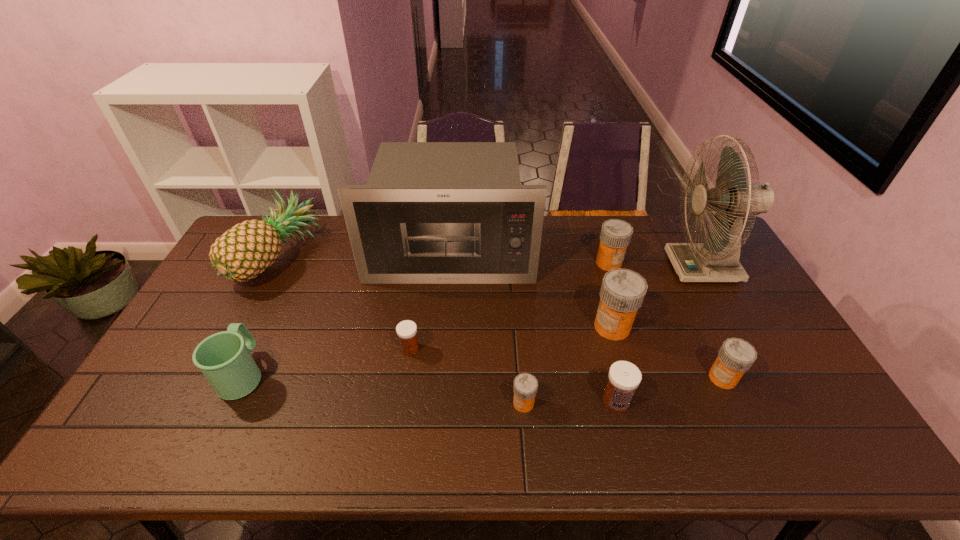
This screenshot has height=540, width=960. I want to click on pineapple that is at the far edge, so click(x=247, y=249).

The width and height of the screenshot is (960, 540). Identify the location of medicine that is positioned at the far edge. (615, 236).

Where is `object at the left edge`? This screenshot has height=540, width=960. object at the left edge is located at coordinates (247, 249).

Find the location of a particular element. The image size is (960, 540). object present at the right edge is located at coordinates (717, 259).

Where is `object located at the far left corner`? object located at the far left corner is located at coordinates (247, 249).

The height and width of the screenshot is (540, 960). I want to click on object present at the far right corner, so click(717, 259).

I want to click on blank space at the far edge of the desktop, so click(x=328, y=242).

The image size is (960, 540). In the image, there is a desktop. In order to click on vacant space at the near edge in this screenshot , I will do `click(627, 447)`.

Where is `vacant region at the left edge of the desktop`? vacant region at the left edge of the desktop is located at coordinates (129, 416).

This screenshot has width=960, height=540. Identify the location of vacant region at the right edge of the desktop. (775, 380).